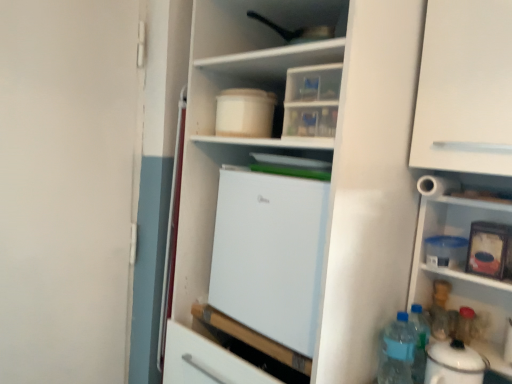
Question: Is white matte refrigerator at center to the left or to the right of translucent plastic bottles at lower right, the first bottle viewed from the left, in the image?

Choices:
 (A) right
 (B) left

Answer: (B)

Question: From a real-world perspective, is white matte refrigerator at center above or below translucent plastic bottles at lower right, which ranks as the 3th bottle in right-to-left order?

Choices:
 (A) above
 (B) below

Answer: (A)

Question: Which object is positioned closest to the translucent plastic bottle at lower right, marked as the 2th bottle in a back-to-front arrangement?

Choices:
 (A) translucent plastic bottles at lower right, the first bottle viewed from the left
 (B) white glossy electric kettle at lower right
 (C) white matte cabinet at upper right
 (D) blue plastic bottle at lower right, the first bottle viewed from the back
 (E) white matte refrigerator at center

Answer: (D)

Question: Which of these objects is positioned closest to the blue plastic bottle at lower right, the first bottle viewed from the back?

Choices:
 (A) white glossy electric kettle at lower right
 (B) translucent plastic bottles at lower right, which ranks as the 3th bottle in right-to-left order
 (C) white matte cabinet at upper right
 (D) translucent plastic bottle at lower right, marked as the 3th bottle in a left-to-right arrangement
 (E) white matte screen door at left

Answer: (D)